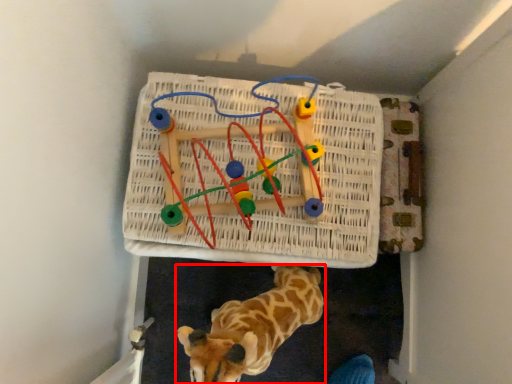
Question: From the image's perspective, what is the correct spatial positioning of giraffe (annotated by the red box) in reference to toy?

Choices:
 (A) below
 (B) above

Answer: (A)